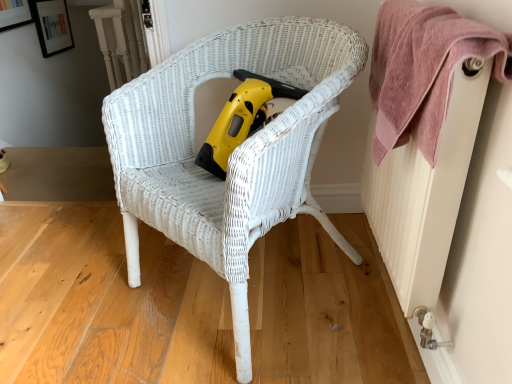
This screenshot has height=384, width=512. Describe the element at coordinates (242, 118) in the screenshot. I see `yellow plastic vacuum at center` at that location.

This screenshot has height=384, width=512. What do you see at coordinates (424, 196) in the screenshot?
I see `white textured radiator at right` at bounding box center [424, 196].

Describe the element at coordinates (232, 152) in the screenshot. The width and height of the screenshot is (512, 384). I see `white wicker chair at center` at that location.

Where is `yellow plastic vacuum at center`? This screenshot has height=384, width=512. yellow plastic vacuum at center is located at coordinates [242, 118].

Is pink textured towel at upper right thinner than white textured radiator at right?

No.

From a real-world perspective, is pink textured towel at upper right over white textured radiator at right?

Yes, from a real-world perspective, pink textured towel at upper right is above white textured radiator at right.

Considering the sizes of pink textured towel at upper right and white textured radiator at right in the image, is pink textured towel at upper right taller or shorter than white textured radiator at right?

pink textured towel at upper right is shorter than white textured radiator at right.

Who is more distant, pink textured towel at upper right or white textured radiator at right?

pink textured towel at upper right is further away from the camera.

Does point (454, 50) appear closer or farther from the camera than point (254, 96)?

Point (454, 50) is closer to the camera than point (254, 96).

Which object is thinner, pink textured towel at upper right or yellow plastic vacuum at center?

pink textured towel at upper right is thinner.

Is pink textured towel at upper right positioned in front of yellow plastic vacuum at center?

Yes.

The height and width of the screenshot is (384, 512). In order to click on towel to the right of yellow plastic vacuum at center in this screenshot , I will do `click(423, 70)`.

Is white wicker chair at center inside the boundaries of yellow plastic vacuum at center, or outside?

white wicker chair at center is not inside yellow plastic vacuum at center, it's outside.

Which is closer to the camera, (310,161) or (230,146)?

Point (310,161) appears to be farther away from the viewer than point (230,146).

Is white wicker chair at center far from yellow plastic vacuum at center?

No, white wicker chair at center is in close proximity to yellow plastic vacuum at center.

Considering the sizes of objects white wicker chair at center and yellow plastic vacuum at center in the image provided, who is shorter, white wicker chair at center or yellow plastic vacuum at center?

yellow plastic vacuum at center is shorter.

Who is shorter, white textured radiator at right or white wicker chair at center?

With less height is white textured radiator at right.

Is white textured radiator at right facing away from white wicker chair at center?

Yes, white textured radiator at right is facing away from white wicker chair at center.

From a real-world perspective, is white textured radiator at right on white wicker chair at center?

Correct, in the physical world, white textured radiator at right is higher than white wicker chair at center.

Is point (397, 278) in front of point (231, 212)?

No.

Considering their positions, is white wicker chair at center located in front of or behind white textured radiator at right?

white wicker chair at center is positioned farther from the viewer than white textured radiator at right.

Can you confirm if white wicker chair at center is taller than white textured radiator at right?

Yes.

Does white wicker chair at center have a greater width compared to white textured radiator at right?

Correct, the width of white wicker chair at center exceeds that of white textured radiator at right.

Is point (286, 144) positioned in front of point (445, 257)?

No, it is not.

Considering the sizes of yellow plastic vacuum at center and white wicker chair at center in the image, is yellow plastic vacuum at center taller or shorter than white wicker chair at center?

Considering their sizes, yellow plastic vacuum at center has less height than white wicker chair at center.

Is yellow plastic vacuum at center smaller than white wicker chair at center?

Indeed, yellow plastic vacuum at center has a smaller size compared to white wicker chair at center.

Looking at this image, would you say white wicker chair at center is part of yellow plastic vacuum at center's contents?

No, white wicker chair at center is located outside of yellow plastic vacuum at center.

Which is in front, point (264, 96) or point (124, 191)?

The point (124, 191) is more forward.

Looking at this image, is white textured radiator at right bigger or smaller than yellow plastic vacuum at center?

Considering their sizes, white textured radiator at right takes up more space than yellow plastic vacuum at center.

Does point (460, 188) lie in front of point (242, 84)?

Yes, it is.

Is white textured radiator at right positioned far away from yellow plastic vacuum at center?

white textured radiator at right is near yellow plastic vacuum at center, not far away.

Is white textured radiator at right looking in the opposite direction of yellow plastic vacuum at center?

No, yellow plastic vacuum at center is not at the back of white textured radiator at right.

You are a GUI agent. You are given a task and a screenshot of the screen. Output one action in this format:
    pyautogui.click(x=<x>, y=<y>)
    Task: Click on the towel above the white textured radiator at right (from a real-world perspective)
    Image resolution: width=512 pixels, height=384 pixels.
    Given the screenshot: What is the action you would take?
    pyautogui.click(x=423, y=70)

The width and height of the screenshot is (512, 384). What are the coordinates of `vacuum on the left side of pink textured towel at upper right` in the screenshot? It's located at (242, 118).

Looking at the image, which one is located further to yellow plastic vacuum at center, white wicker chair at center or white textured radiator at right?

The object further to yellow plastic vacuum at center is white textured radiator at right.

From the picture: Based on their spatial positions, is white wicker chair at center or pink textured towel at upper right closer to yellow plastic vacuum at center?

Based on the image, white wicker chair at center appears to be nearer to yellow plastic vacuum at center.

Which object lies further to the anchor point pink textured towel at upper right, yellow plastic vacuum at center or white wicker chair at center?

yellow plastic vacuum at center is further to pink textured towel at upper right.

Considering their positions, is white wicker chair at center positioned further to pink textured towel at upper right than white textured radiator at right?

white wicker chair at center is positioned further to the anchor pink textured towel at upper right.

Considering their positions, is pink textured towel at upper right positioned closer to white textured radiator at right than yellow plastic vacuum at center?

The object closer to white textured radiator at right is pink textured towel at upper right.

From the image, which object appears to be farther from white textured radiator at right, pink textured towel at upper right or white wicker chair at center?

Based on the image, white wicker chair at center appears to be further to white textured radiator at right.

Estimate the real-world distances between objects in this image. Which object is further from pink textured towel at upper right, white wicker chair at center or yellow plastic vacuum at center?

The object further to pink textured towel at upper right is yellow plastic vacuum at center.

Considering their positions, is white wicker chair at center positioned further to white textured radiator at right than pink textured towel at upper right?

white wicker chair at center.

Where is `chair positioned between pink textured towel at upper right and yellow plastic vacuum at center from near to far`? This screenshot has height=384, width=512. chair positioned between pink textured towel at upper right and yellow plastic vacuum at center from near to far is located at coordinates (232, 152).

Locate an element on the screen. Image resolution: width=512 pixels, height=384 pixels. chair located between white textured radiator at right and yellow plastic vacuum at center in the depth direction is located at coordinates (232, 152).

Identify the location of towel between white textured radiator at right and yellow plastic vacuum at center in the front-back direction. This screenshot has width=512, height=384. (423, 70).

Image resolution: width=512 pixels, height=384 pixels. I want to click on towel between white wicker chair at center and white textured radiator at right, so click(x=423, y=70).